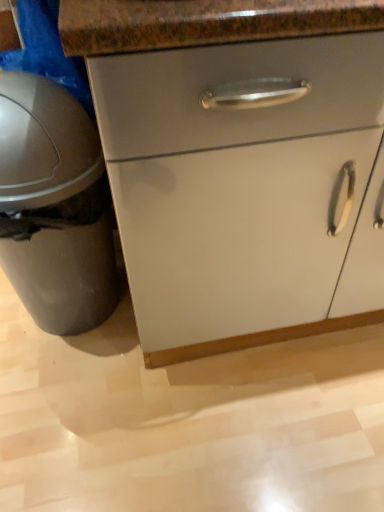
Locate an element on the screen. This screenshot has width=384, height=512. gray matte trash can at left is located at coordinates (54, 207).

What is the approximate width of gray matte trash can at left?

gray matte trash can at left is 16.47 inches in width.

Measure the distance between gray matte trash can at left and camera.

A distance of 34.40 inches exists between gray matte trash can at left and camera.

What do you see at coordinates (54, 207) in the screenshot? This screenshot has height=512, width=384. I see `gray matte trash can at left` at bounding box center [54, 207].

Identify the location of gray matte trash can at left. The height and width of the screenshot is (512, 384). (54, 207).